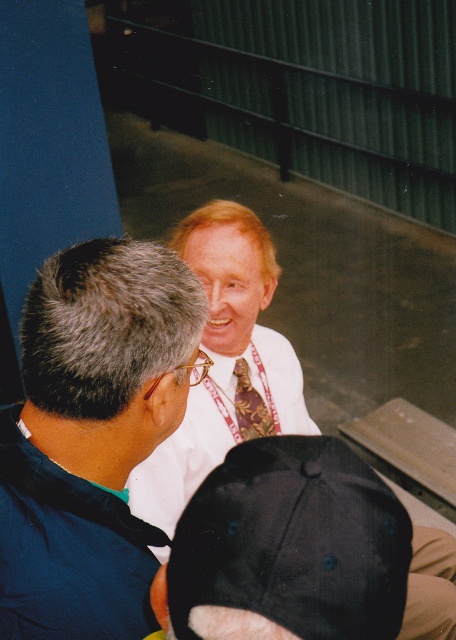
Who is lower down, white fabric at center or brown patterned tie at center?

brown patterned tie at center

Can you confirm if white fabric at center is shorter than brown patterned tie at center?

No, white fabric at center is not shorter than brown patterned tie at center.

Which is in front, point (145, 433) or point (264, 419)?

Positioned in front is point (145, 433).

Locate an element on the screen. This screenshot has height=640, width=456. white fabric at center is located at coordinates (91, 436).

The height and width of the screenshot is (640, 456). What do you see at coordinates (91, 436) in the screenshot? I see `white fabric at center` at bounding box center [91, 436].

Is white fabric at center positioned at the back of white satin dress shirt at center?

No, it is in front of white satin dress shirt at center.

Identify the location of white fabric at center. This screenshot has height=640, width=456. (91, 436).

Is white fabric at center above black fabric baseball cap at lower center?

Yes, white fabric at center is above black fabric baseball cap at lower center.

Who is taller, white fabric at center or black fabric baseball cap at lower center?

white fabric at center is taller.

Is point (87, 316) positioned after point (389, 636)?

Yes, it is behind point (389, 636).

At what (x,y) coordinates should I click in order to perform the action: click on white fabric at center. Please return your answer as a coordinate pair (x, y). The width and height of the screenshot is (456, 640). Looking at the image, I should click on (91, 436).